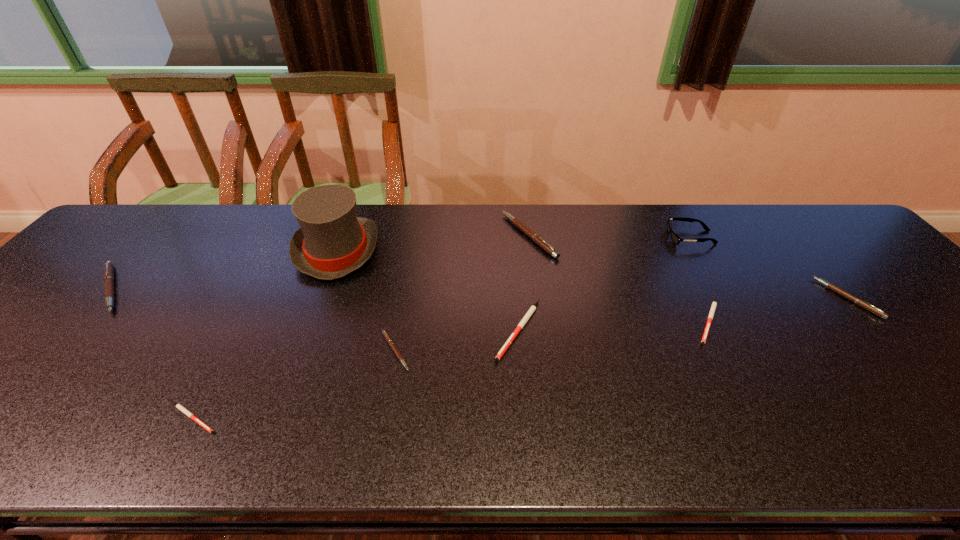
I want to click on free space between the second tallest object and the sixth pen from right to left, so click(x=442, y=328).

Locate an element on the screen. The height and width of the screenshot is (540, 960). empty location between the dress hat and the nearest pink pen is located at coordinates (367, 301).

The width and height of the screenshot is (960, 540). I want to click on vacant area that lies between the rightmost white pen and the leftmost pink pen, so click(410, 305).

Find the location of a particular element. the second closest object to the biggest white pen is located at coordinates (385, 334).

Choose which object is the nearest neighbor to the second biggest white pen. Please provide its 2D coordinates. Your answer should be formatted as a tuple, i.e. [(x, y)], where the tuple contains the x and y coordinates of a point satisfying the conditions above.

[(676, 239)]

Identify which pen is the sixth nearest to the nearest pen. Please provide its 2D coordinates. Your answer should be formatted as a tuple, i.e. [(x, y)], where the tuple contains the x and y coordinates of a point satisfying the conditions above.

[(858, 301)]

Locate which pen is the closest to the tallest object. Please provide its 2D coordinates. Your answer should be formatted as a tuple, i.e. [(x, y)], where the tuple contains the x and y coordinates of a point satisfying the conditions above.

[(385, 334)]

Find the location of a particular element. This screenshot has width=960, height=540. pink pen that stands as the third closest to the second pink pen from right to left is located at coordinates (108, 269).

Locate which pink pen is the closest to the fourth object from left to right. Please provide its 2D coordinates. Your answer should be formatted as a tuple, i.e. [(x, y)], where the tuple contains the x and y coordinates of a point satisfying the conditions above.

[(534, 237)]

This screenshot has width=960, height=540. Identify the location of white pen that is the second closest to the second white pen from right to left. (181, 408).